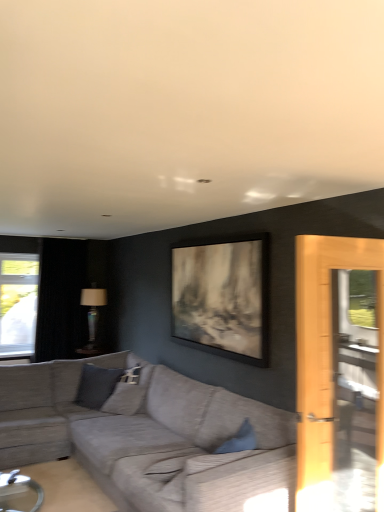
What is the approximate height of matte glass lamp at center?

The height of matte glass lamp at center is 36.78 inches.

Find the location of a particular element. The width and height of the screenshot is (384, 512). textured gray couch at center is located at coordinates (151, 438).

Locate an element on the screen. matte glass lamp at center is located at coordinates (92, 315).

Considering the sizes of objects black velvet curtain at left and matte glass lamp at center in the image provided, who is bigger, black velvet curtain at left or matte glass lamp at center?

black velvet curtain at left.

What's the angular difference between black velvet curtain at left and matte glass lamp at center's facing directions?

The angular difference between black velvet curtain at left and matte glass lamp at center is 89.3 degrees.

Which of these two, black velvet curtain at left or matte glass lamp at center, stands taller?

Standing taller between the two is black velvet curtain at left.

Is the surface of black velvet curtain at left in direct contact with matte glass lamp at center?

There is a gap between black velvet curtain at left and matte glass lamp at center.

Can you confirm if matte glass lamp at center is positioned to the right of gray fabric pillow at center?

In fact, matte glass lamp at center is to the left of gray fabric pillow at center.

Is matte glass lamp at center facing away from gray fabric pillow at center?

No, gray fabric pillow at center is not at the back of matte glass lamp at center.

Which object is more forward, matte glass lamp at center or gray fabric pillow at center?

Positioned in front is gray fabric pillow at center.

Based on the photo, is matte glass lamp at center not near gray fabric pillow at center?

Yes, matte glass lamp at center and gray fabric pillow at center are quite far apart.

From the image's perspective, is gray fabric pillow at center below matte glass lamp at center?

Indeed, from the image's perspective, gray fabric pillow at center is shown beneath matte glass lamp at center.

Considering the positions of objects gray fabric pillow at center and matte glass lamp at center in the image provided, who is behind, gray fabric pillow at center or matte glass lamp at center?

matte glass lamp at center is further from the camera.

Do you think gray fabric pillow at center is within matte glass lamp at center, or outside of it?

gray fabric pillow at center lies outside matte glass lamp at center.

Based on the photo, from a real-world perspective, between gray fabric pillow at center and matte glass lamp at center, who is vertically higher?

matte glass lamp at center.

From the image's perspective, is textured gray couch at center located above matte glass lamp at center?

No.

Considering the positions of objects textured gray couch at center and matte glass lamp at center in the image provided, who is more to the right, textured gray couch at center or matte glass lamp at center?

From the viewer's perspective, textured gray couch at center appears more on the right side.

Is textured gray couch at center next to matte glass lamp at center and touching it?

textured gray couch at center is not next to matte glass lamp at center, and they're not touching.

Based on their sizes in the image, would you say textured gray couch at center is bigger or smaller than matte glass lamp at center?

Clearly, textured gray couch at center is larger in size than matte glass lamp at center.

Does point (76, 337) appear closer or farther from the camera than point (18, 454)?

Point (76, 337).

Considering the relative positions of black velvet curtain at left and textured gray couch at center in the image provided, is black velvet curtain at left to the right of textured gray couch at center from the viewer's perspective?

No.

Could textured gray couch at center be considered to be inside black velvet curtain at left?

That's incorrect, textured gray couch at center is not inside black velvet curtain at left.

Is gray fabric pillow at center shorter than black velvet curtain at left?

Correct, gray fabric pillow at center is not as tall as black velvet curtain at left.

Considering the relative positions of gray fabric pillow at center and black velvet curtain at left in the image provided, is gray fabric pillow at center to the left of black velvet curtain at left from the viewer's perspective?

No.

What are the coordinates of `pillow that is in front of the black velvet curtain at left` in the screenshot? It's located at (125, 399).

How different are the orientations of gray fabric pillow at center and black velvet curtain at left in degrees?

76.1 degrees separate the facing orientations of gray fabric pillow at center and black velvet curtain at left.

Is gray fabric pillow at center in front of or behind textured gray couch at center in the image?

gray fabric pillow at center is behind textured gray couch at center.

Would you say gray fabric pillow at center is a long distance from textured gray couch at center?

No, gray fabric pillow at center is not far away from textured gray couch at center.

Would you say gray fabric pillow at center is inside or outside textured gray couch at center?

gray fabric pillow at center is located inside textured gray couch at center.

You are a GUI agent. You are given a task and a screenshot of the screen. Output one action in this format:
    pyautogui.click(x=<x>, y=<y>)
    Task: Click on the lamp beneath the black velvet curtain at left (from a real-world perspective)
    This screenshot has height=512, width=384.
    Given the screenshot: What is the action you would take?
    [x=92, y=315]

You are a GUI agent. You are given a task and a screenshot of the screen. Output one action in this format:
    pyautogui.click(x=<x>, y=<y>)
    Task: Click on the lamp that appears above the gray fabric pillow at center (from the image's perspective)
    
    Given the screenshot: What is the action you would take?
    pyautogui.click(x=92, y=315)

Which object lies nearer to the anchor point gray fabric pillow at center, textured gray couch at center or black velvet curtain at left?

textured gray couch at center is closer to gray fabric pillow at center.

Considering their positions, is black velvet curtain at left positioned further to gray fabric pillow at center than textured gray couch at center?

black velvet curtain at left.

Based on their spatial positions, is black velvet curtain at left or gray fabric pillow at center closer to matte glass lamp at center?

black velvet curtain at left is positioned closer to the anchor matte glass lamp at center.

When comparing their distances from textured gray couch at center, does gray fabric pillow at center or black velvet curtain at left seem closer?

Among the two, gray fabric pillow at center is located nearer to textured gray couch at center.

Looking at the image, which one is located further to textured gray couch at center, matte glass lamp at center or gray fabric pillow at center?

matte glass lamp at center is positioned further to the anchor textured gray couch at center.

Estimate the real-world distances between objects in this image. Which object is closer to black velvet curtain at left, gray fabric pillow at center or matte glass lamp at center?

Based on the image, matte glass lamp at center appears to be nearer to black velvet curtain at left.

Estimate the real-world distances between objects in this image. Which object is closer to gray fabric pillow at center, matte glass lamp at center or textured gray couch at center?

The object closer to gray fabric pillow at center is textured gray couch at center.

Estimate the real-world distances between objects in this image. Which object is closer to gray fabric pillow at center, matte glass lamp at center or black velvet curtain at left?

matte glass lamp at center lies closer to gray fabric pillow at center than the other object.

I want to click on pillow positioned between textured gray couch at center and black velvet curtain at left from near to far, so click(x=125, y=399).

Where is `pillow between textured gray couch at center and matte glass lamp at center along the z-axis`? pillow between textured gray couch at center and matte glass lamp at center along the z-axis is located at coordinates (125, 399).

Identify the location of curtain between gray fabric pillow at center and matte glass lamp at center from front to back. (61, 298).

I want to click on curtain positioned between textured gray couch at center and matte glass lamp at center from near to far, so click(x=61, y=298).